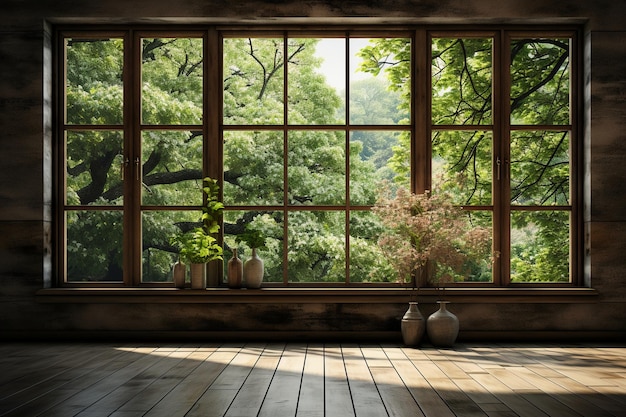
The image size is (626, 417). Find the location of `sections of window in middle row`. sections of window in middle row is located at coordinates (85, 175), (160, 169), (245, 165), (322, 167), (374, 162), (454, 169), (535, 168).